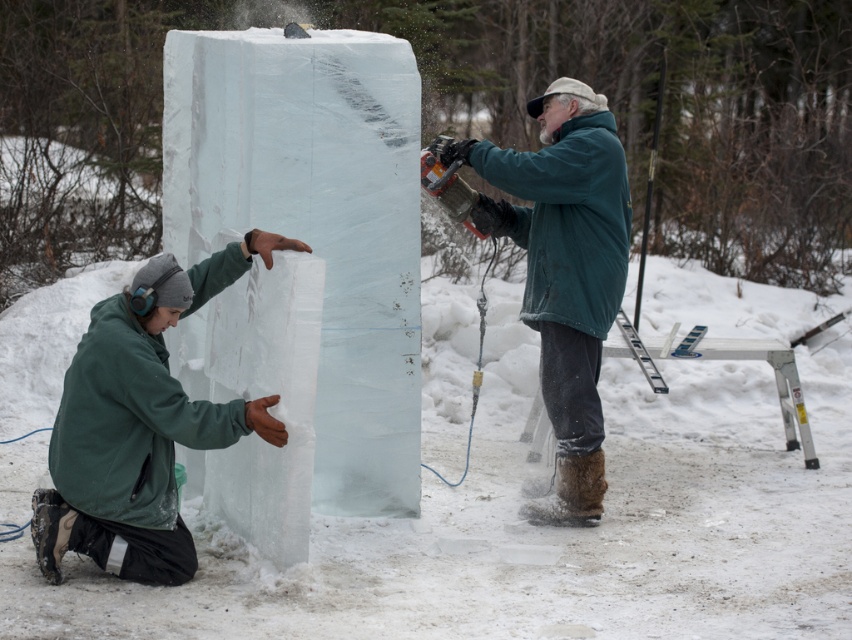
Question: Is green matte jacket at lower left positioned in front of green matte jacket at center?

Choices:
 (A) no
 (B) yes

Answer: (B)

Question: Among these objects, which one is farthest from the camera?

Choices:
 (A) green matte jacket at lower left
 (B) green matte jacket at center

Answer: (B)

Question: Which object is farther from the camera taking this photo?

Choices:
 (A) green matte jacket at lower left
 (B) green matte jacket at center

Answer: (B)

Question: Can you confirm if green matte jacket at lower left is positioned to the left of green matte jacket at center?

Choices:
 (A) yes
 (B) no

Answer: (A)

Question: Which object appears farthest from the camera in this image?

Choices:
 (A) green matte jacket at lower left
 (B) green matte jacket at center

Answer: (B)

Question: Can you confirm if green matte jacket at lower left is positioned below green matte jacket at center?

Choices:
 (A) no
 (B) yes

Answer: (B)